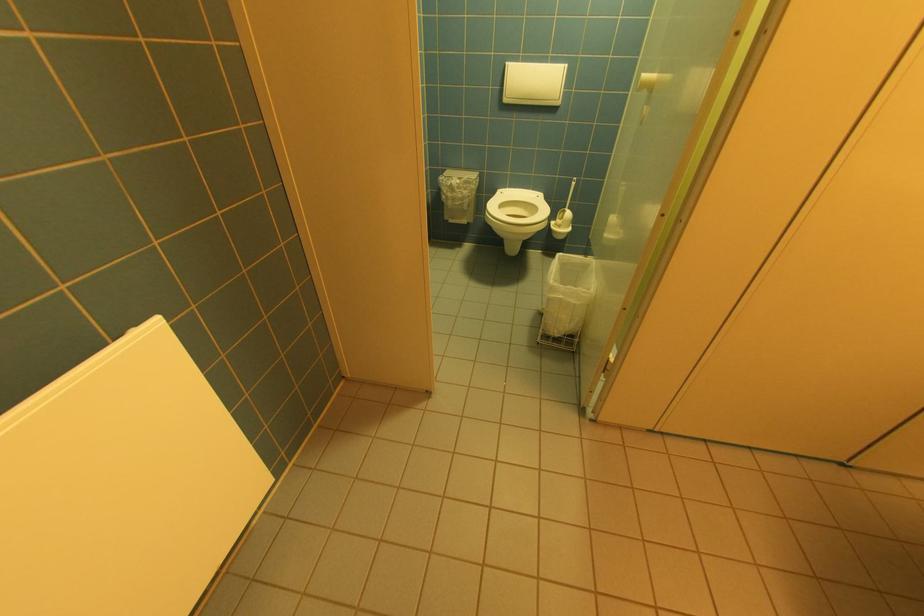
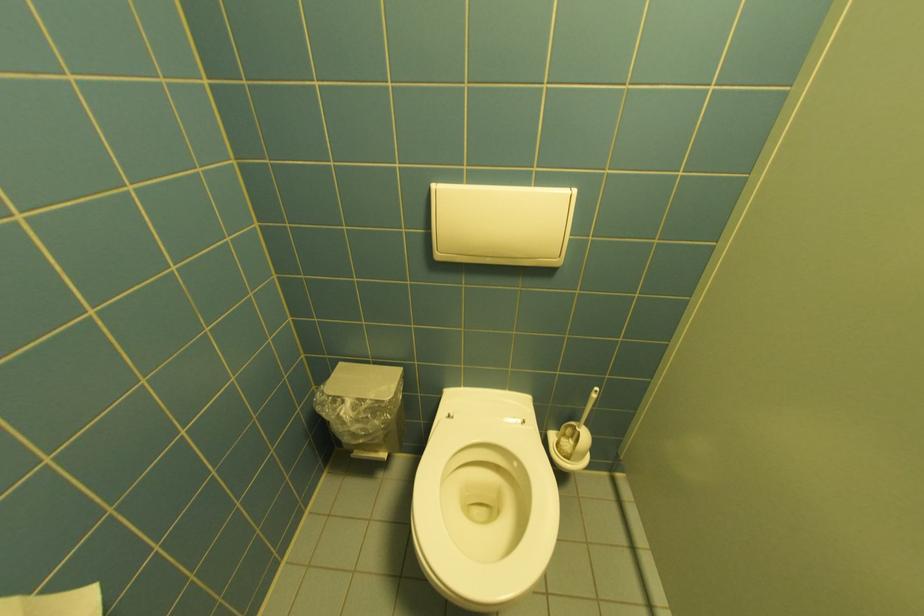
Question: In a continuous first-person perspective shot, in which direction is the camera moving?

Choices:
 (A) Left
 (B) Right
 (C) Forward
 (D) Backward

Answer: (C)